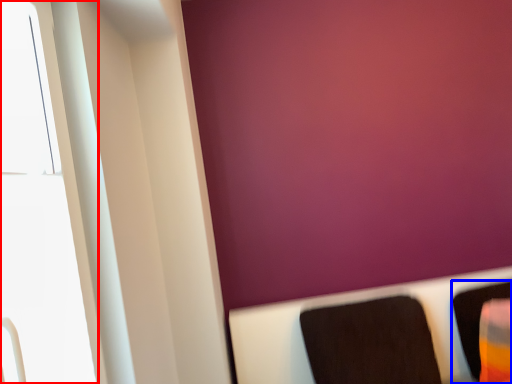
Question: Which object appears closest to the camera in this image, window (highlighted by a red box) or furniture (highlighted by a blue box)?

Choices:
 (A) window
 (B) furniture

Answer: (A)